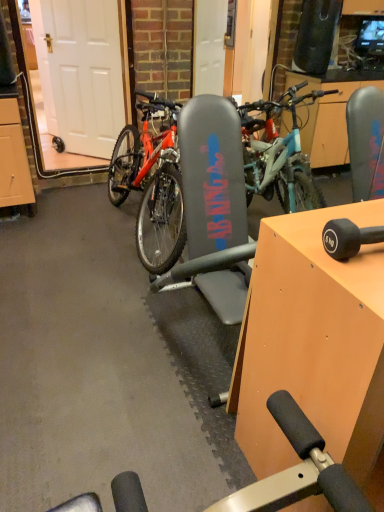
Question: In terms of height, does white matte door at left look taller or shorter compared to orange wood table at center?

Choices:
 (A) short
 (B) tall

Answer: (B)

Question: In terms of width, does white matte door at left look wider or thinner when compared to orange wood table at center?

Choices:
 (A) thin
 (B) wide

Answer: (A)

Question: Based on their relative distances, which object is nearer to the orange wood table at center?

Choices:
 (A) white matte door at left
 (B) matte black bicycle at center

Answer: (B)

Question: Which object is the closest to the orange wood table at center?

Choices:
 (A) white matte door at left
 (B) matte black bicycle at center

Answer: (B)